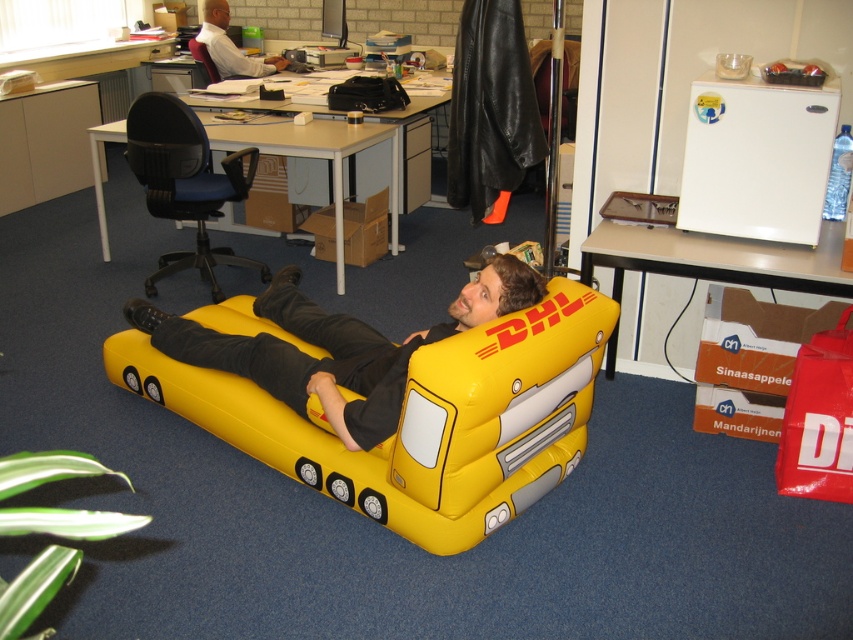
You are organizing the office and need to move the white plastic computer desk at lower right closer to the smooth black office chair at upper left. Which direction should you move the desk?

You should move the white plastic computer desk at lower right to the left to place it closer to the smooth black office chair at upper left since the desk is currently to the right of the chair.